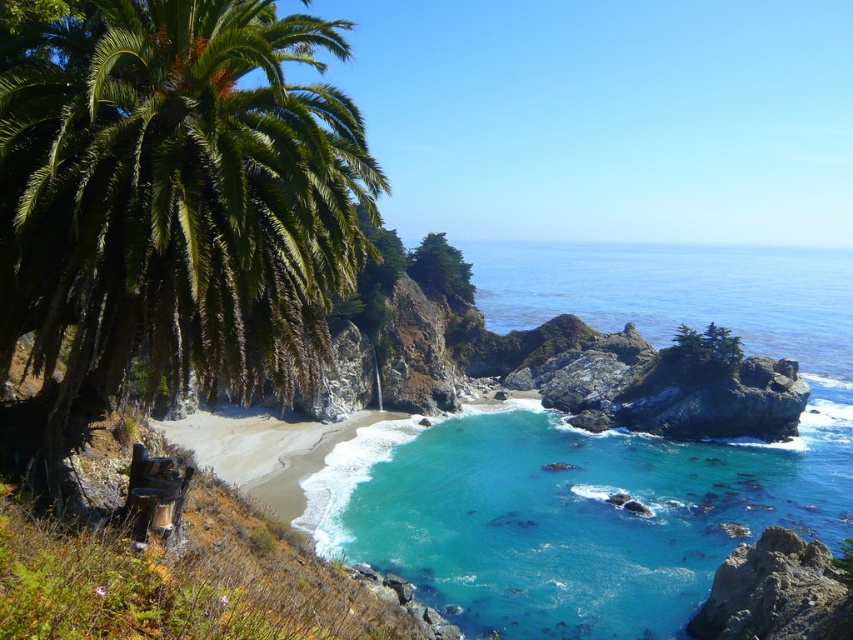
You are standing on the beach and want to take a photo that includes both the green leafy palm tree at left and the clear blue water at center. Which object should you position closer to the edge of the frame to ensure both are visible?

Since the green leafy palm tree at left is smaller than the clear blue water at center, you should position the green leafy palm tree at left closer to the edge of the frame to ensure both are visible.

You are standing on the beach and want to walk to both the point at coordinates point (19, 294) and point (587, 540). Which point should you visit first if you want to minimize the distance walked?

You should visit point (19, 294) first because it is closer to you than point (587, 540).

You are standing on the beach and want to take a photo of the green leafy palm tree at left and the turquoise glossy water at center. Which object is closer to you?

The green leafy palm tree at left is closer to you because it is positioned over the turquoise glossy water at center, indicating it is in front.